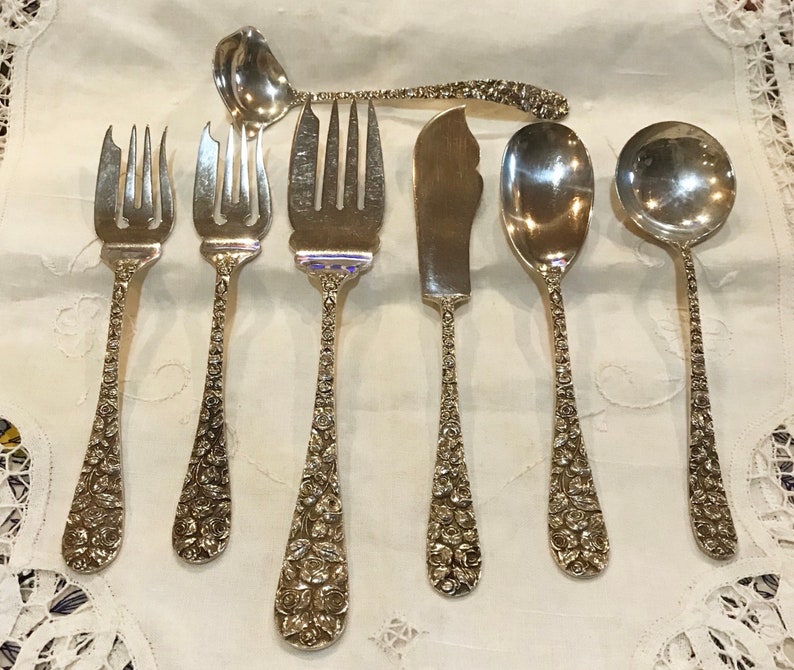
Locate an element on the screen. This screenshot has height=670, width=794. utensils is located at coordinates click(x=721, y=496), click(x=584, y=529), click(x=452, y=545), click(x=311, y=590), click(x=203, y=515), click(x=118, y=521), click(x=378, y=92).